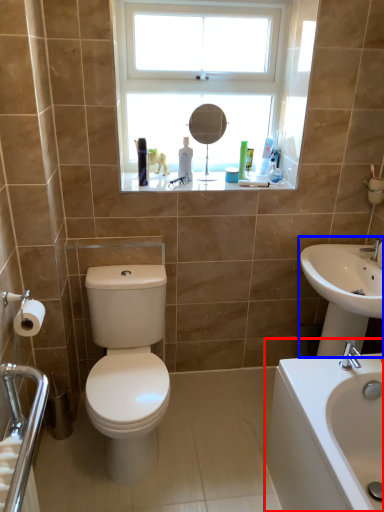
Question: Which of the following is the farthest to the observer, sink (highlighted by a red box) or sink (highlighted by a blue box)?

Choices:
 (A) sink
 (B) sink

Answer: (B)